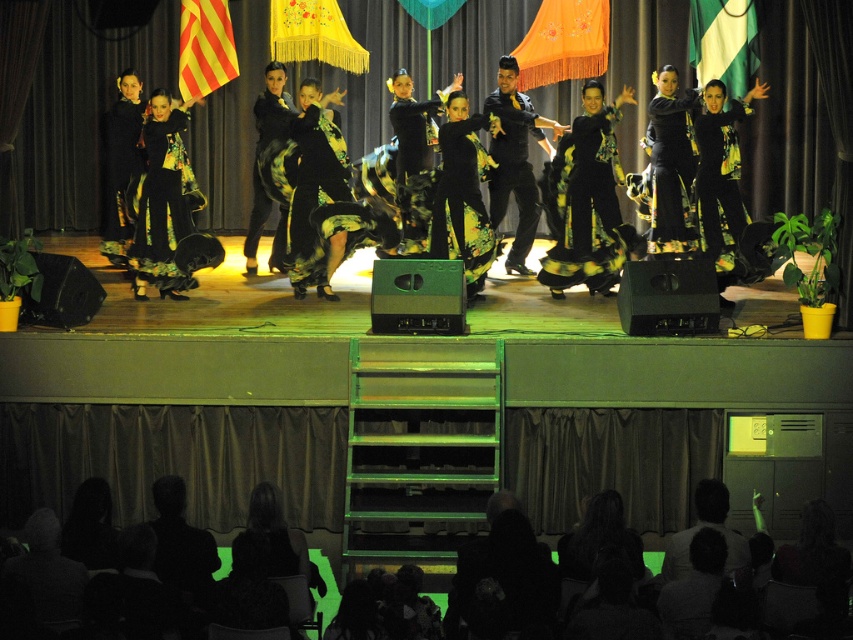
Question: Is black floral dress at center bigger than black matte suit at center?

Choices:
 (A) yes
 (B) no

Answer: (B)

Question: Which object is the closest to the black matte suit at center?

Choices:
 (A) black floral dress at center
 (B) black satin dress at center

Answer: (A)

Question: Is black satin dress at center positioned at the back of black matte suit at center?

Choices:
 (A) yes
 (B) no

Answer: (B)

Question: Can you confirm if black satin dress at center is wider than black matte suit at center?

Choices:
 (A) yes
 (B) no

Answer: (A)

Question: Among these points, which one is farthest from the camera?

Choices:
 (A) (434, 202)
 (B) (560, 294)
 (C) (494, 97)

Answer: (C)

Question: Which is farther from the black floral dress at center?

Choices:
 (A) black satin dress at center
 (B) black matte suit at center

Answer: (A)